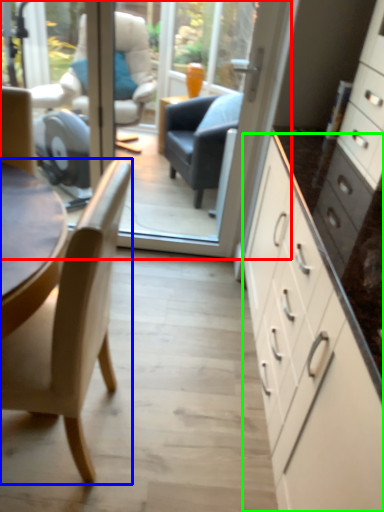
Question: Which object is positioned farthest from glass door (highlighted by a red box)? Select from chair (highlighted by a blue box) and cabinetry (highlighted by a green box).

Choices:
 (A) chair
 (B) cabinetry

Answer: (A)